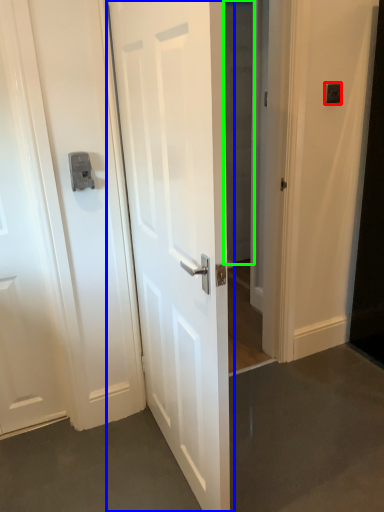
Question: Which object is positioned closest to light switch (highlighted by a red box)? Select from door (highlighted by a blue box) and glass door (highlighted by a green box).

Choices:
 (A) door
 (B) glass door

Answer: (B)